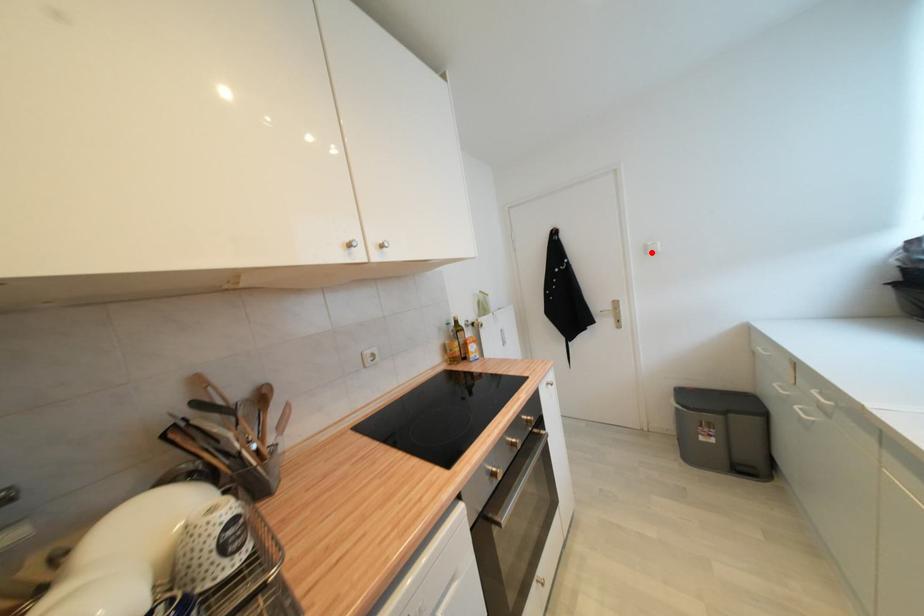
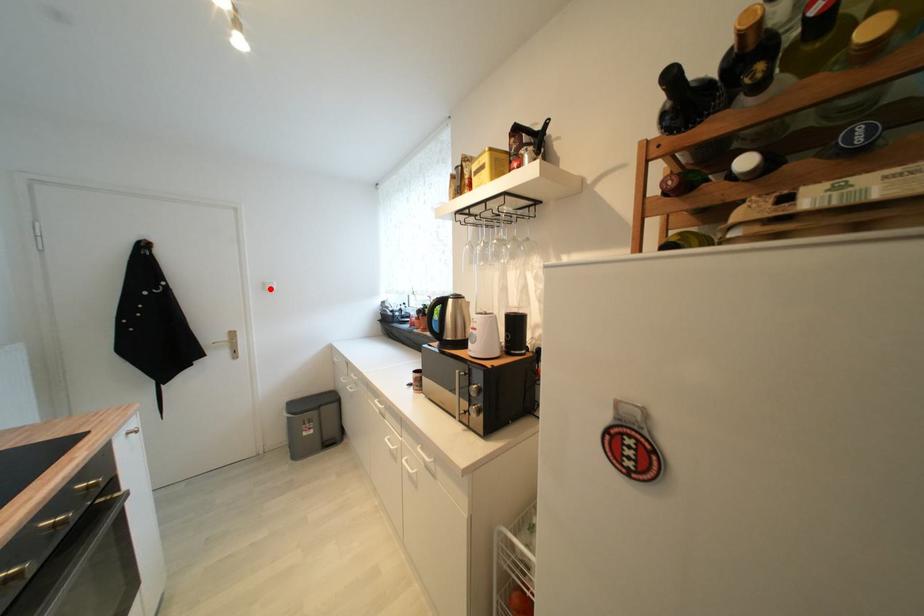
I am providing you with two images of the same scene from different viewpoints. A red point is marked on the first image and another point is marked on the second image. Do the highlighted points in image1 and image2 indicate the same real-world spot?

Yes